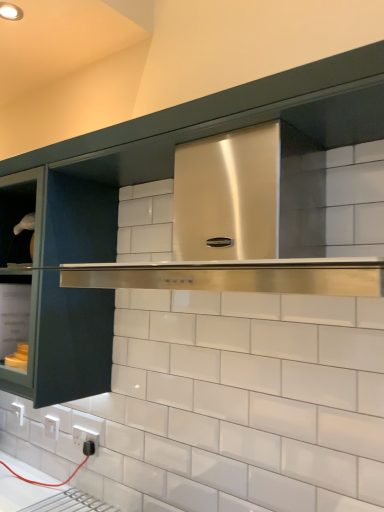
Question: Can you confirm if black plastic electric outlet at lower left, the second electric outlet viewed from the back, is thinner than white plastic electric outlet at lower left, which is the 2th electric outlet in front-to-back order?

Choices:
 (A) no
 (B) yes

Answer: (A)

Question: Considering the relative sizes of black plastic electric outlet at lower left, placed as the first electric outlet when sorted from front to back, and white plastic electric outlet at lower left, positioned as the first electric outlet in left-to-right order, in the image provided, is black plastic electric outlet at lower left, placed as the first electric outlet when sorted from front to back, taller than white plastic electric outlet at lower left, positioned as the first electric outlet in left-to-right order,?

Choices:
 (A) yes
 (B) no

Answer: (A)

Question: Does black plastic electric outlet at lower left, the second electric outlet viewed from the back, lie behind white plastic electric outlet at lower left, positioned as the first electric outlet in left-to-right order?

Choices:
 (A) yes
 (B) no

Answer: (B)

Question: From a real-world perspective, is black plastic electric outlet at lower left, the second electric outlet viewed from the back, beneath white plastic electric outlet at lower left, positioned as the first electric outlet in left-to-right order?

Choices:
 (A) no
 (B) yes

Answer: (A)

Question: Can we say black plastic electric outlet at lower left, the second electric outlet viewed from the back, lies outside white plastic electric outlet at lower left, positioned as the first electric outlet in left-to-right order?

Choices:
 (A) yes
 (B) no

Answer: (A)

Question: Can you confirm if black plastic electric outlet at lower left, which appears as the 2th electric outlet when viewed from the left, is positioned to the right of white plastic electric outlet at lower left, marked as the 2th electric outlet in a right-to-left arrangement?

Choices:
 (A) no
 (B) yes

Answer: (B)

Question: From the image's perspective, would you say white plastic electric outlet at lower left, positioned as the first electric outlet in left-to-right order, is positioned over stainless steel range hood at center?

Choices:
 (A) yes
 (B) no

Answer: (B)

Question: Is white plastic electric outlet at lower left, marked as the 2th electric outlet in a right-to-left arrangement, aimed at stainless steel range hood at center?

Choices:
 (A) yes
 (B) no

Answer: (B)

Question: Would you say white plastic electric outlet at lower left, marked as the 2th electric outlet in a right-to-left arrangement, is outside stainless steel range hood at center?

Choices:
 (A) no
 (B) yes

Answer: (B)

Question: From a real-world perspective, is white plastic electric outlet at lower left, positioned as the first electric outlet in left-to-right order, positioned over stainless steel range hood at center based on gravity?

Choices:
 (A) yes
 (B) no

Answer: (B)

Question: Is stainless steel range hood at center surrounded by white plastic electric outlet at lower left, which is the 2th electric outlet in front-to-back order?

Choices:
 (A) yes
 (B) no

Answer: (B)

Question: Is white plastic electric outlet at lower left, positioned as the first electric outlet in left-to-right order, facing away from stainless steel range hood at center?

Choices:
 (A) yes
 (B) no

Answer: (B)

Question: From a real-world perspective, is white plastic electric outlet at lower left, marked as the 2th electric outlet in a right-to-left arrangement, below black plastic electric outlet at lower left, placed as the first electric outlet when sorted from front to back?

Choices:
 (A) no
 (B) yes

Answer: (B)